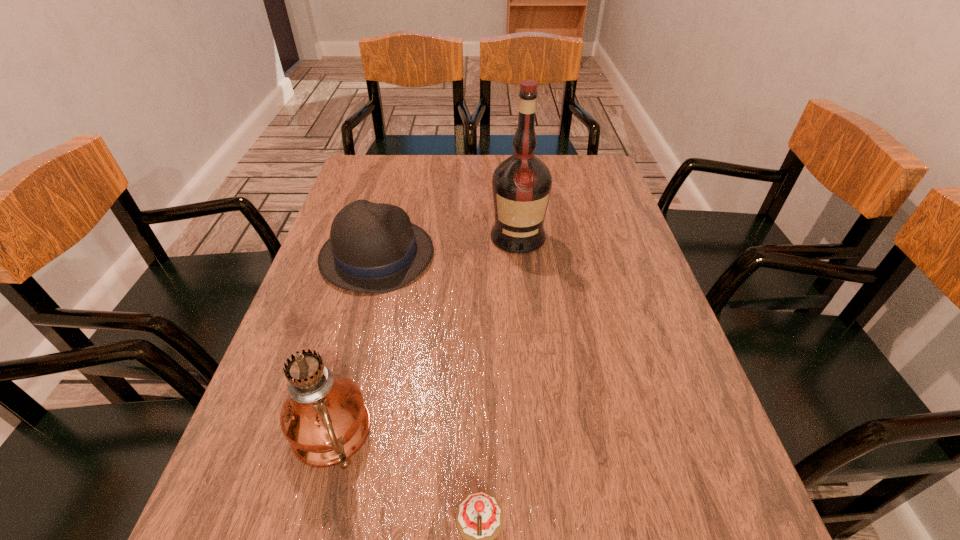
Identify which object is located as the second nearest to the liquor. Please provide its 2D coordinates. Your answer should be formatted as a tuple, i.e. [(x, y)], where the tuple contains the x and y coordinates of a point satisfying the conditions above.

[(324, 418)]

This screenshot has height=540, width=960. I want to click on vacant area that satisfies the following two spatial constraints: 1. on the front-facing side of the second shortest object; 2. on the front side of the second nearest object, so click(x=329, y=436).

The width and height of the screenshot is (960, 540). Identify the location of vacant space that satisfies the following two spatial constraints: 1. on the surface of the liquor; 2. on the front-facing side of the bowler hat. (520, 255).

In order to click on free point that satisfies the following two spatial constraints: 1. on the surface of the liquor; 2. on the front-facing side of the bowler hat in this screenshot , I will do `click(520, 255)`.